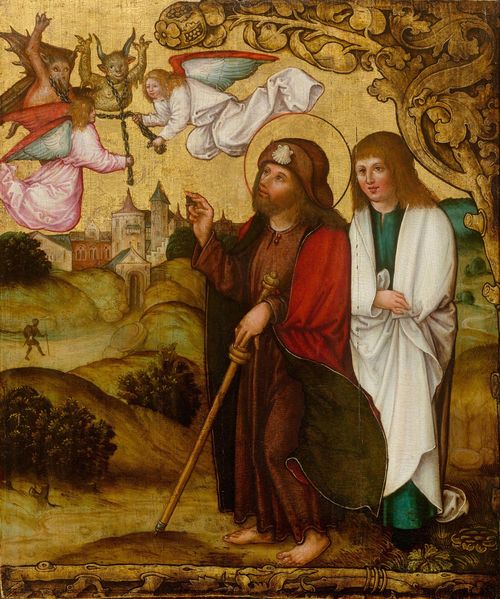
Locate an element on the screen. painting is located at coordinates tap(131, 335).